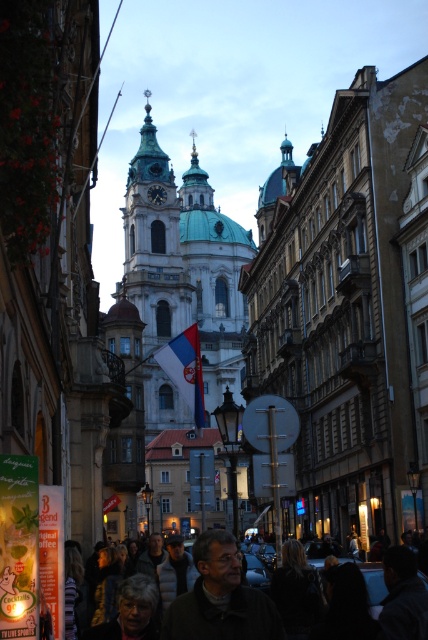
You are a tourist standing on the busy street and want to take a photo of the white stone tower at center without the dark gray wool coat at center blocking the view. Is it possible to do so?

The white stone tower at center is bigger than the dark gray wool coat at center, so it is possible to position yourself or adjust the camera angle to frame the tower without the coat blocking the view.

You are a tourist standing on the street and see the dark gray wool coat at center and the white fabric flag at center. Which object is closer to you?

The dark gray wool coat at center is closer to you because it is below the white fabric flag at center, meaning it is positioned lower in the visual field and thus nearer to the observer.